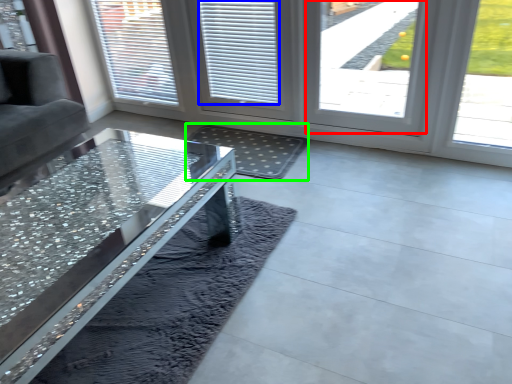
Question: Considering the real-world distances, which object is closest to window (highlighted by a red box)? blind (highlighted by a blue box) or mat (highlighted by a green box).

Choices:
 (A) blind
 (B) mat

Answer: (A)